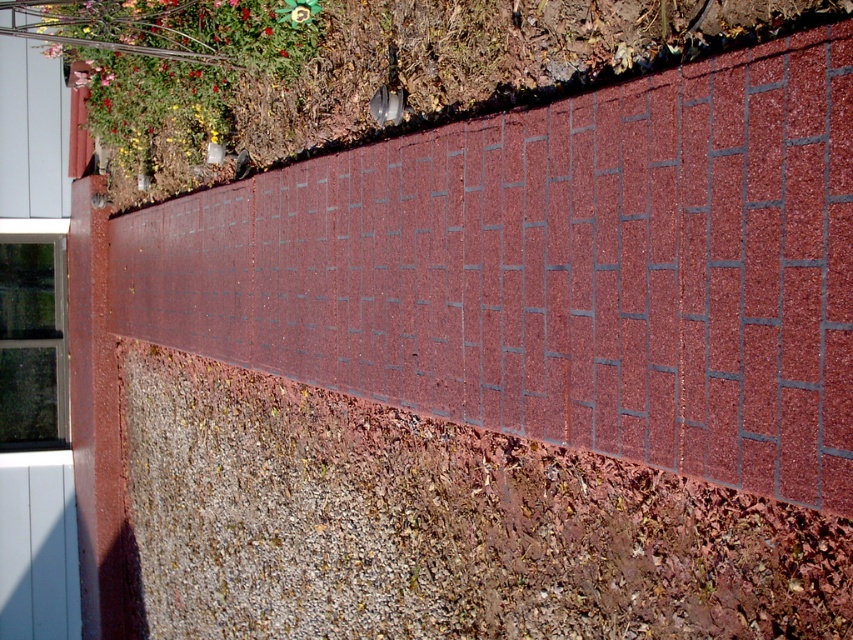
Does brick at center lie behind green leafy plant at upper left?

No, brick at center is closer to the viewer.

Locate an element on the screen. The width and height of the screenshot is (853, 640). brick at center is located at coordinates (556, 269).